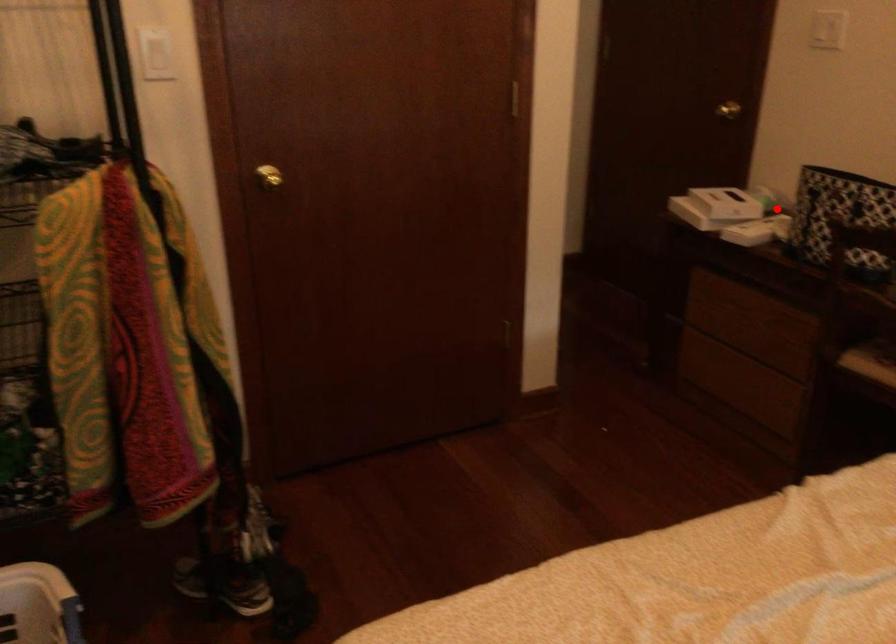
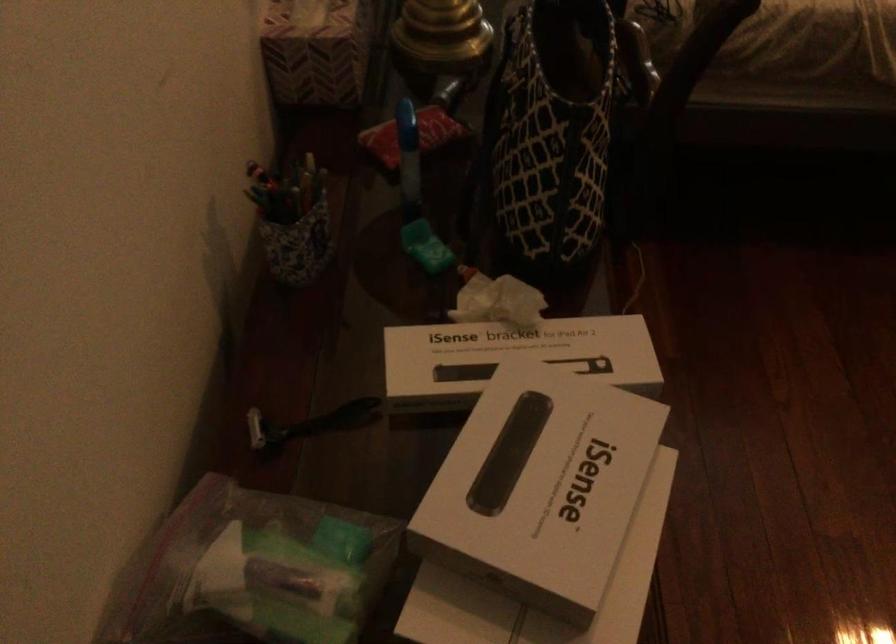
Question: I am providing you with two images of the same scene from different viewpoints. Image1 has a red point marked. In image2, the corresponding 3D location appears at what relative position? Reply with the corresponding letter.

Choices:
 (A) Closer
 (B) Farther

Answer: (A)